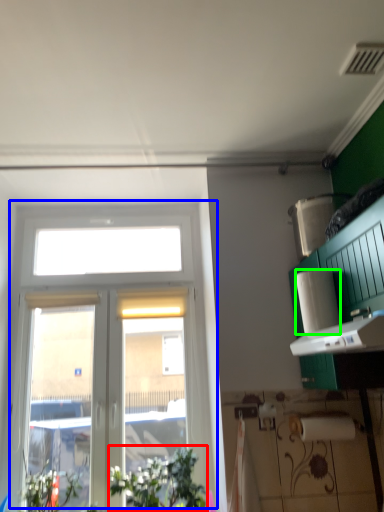
Question: Which is nearer to the plant (highlighted by a red box)? window (highlighted by a blue box) or paper towel (highlighted by a green box).

Choices:
 (A) window
 (B) paper towel

Answer: (A)